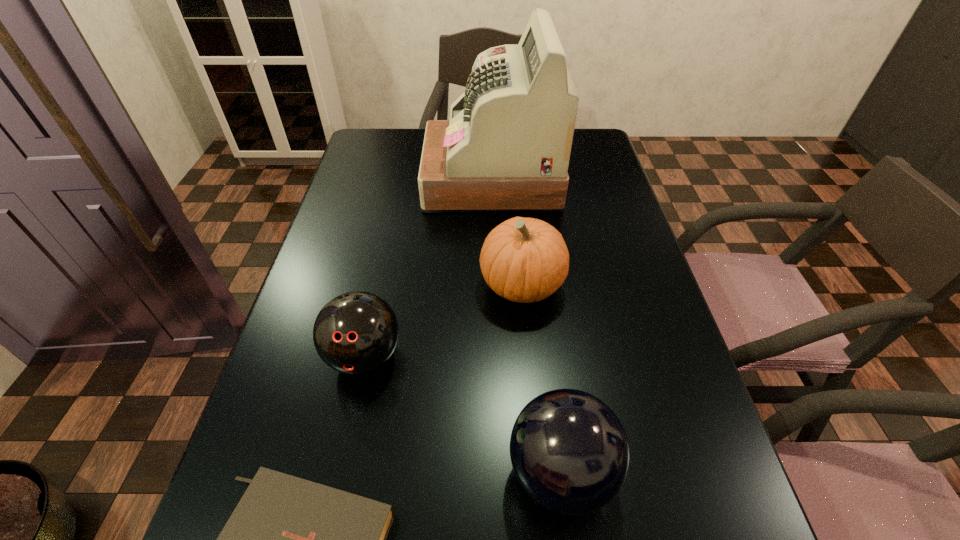
You are a GUI agent. You are given a task and a screenshot of the screen. Output one action in this format:
    pyautogui.click(x=<x>, y=<y>)
    Task: Click on the tallest object
    The image size is (960, 540).
    Given the screenshot: What is the action you would take?
    pyautogui.click(x=506, y=147)

Locate an element on the screen. cash register is located at coordinates [506, 147].

Locate an element on the screen. This screenshot has height=540, width=960. the second farthest object is located at coordinates (525, 260).

Locate an element on the screen. Image resolution: width=960 pixels, height=540 pixels. the nearer bowling ball is located at coordinates (569, 451).

The image size is (960, 540). I want to click on the left bowling ball, so click(356, 332).

The image size is (960, 540). Find the location of `the third farthest object`. the third farthest object is located at coordinates (356, 332).

Identify the location of free location located 0.070m on the operating side of the tallest object. This screenshot has height=540, width=960. 401,179.

This screenshot has width=960, height=540. In order to click on free space located 0.110m on the operating side of the tallest object in this screenshot , I will do `click(388, 179)`.

Where is `free space located on the operating side of the tallest object`? The width and height of the screenshot is (960, 540). free space located on the operating side of the tallest object is located at coordinates (395, 179).

What are the coordinates of `free space located 0.170m on the stem of the pumpkin` in the screenshot? It's located at (405, 285).